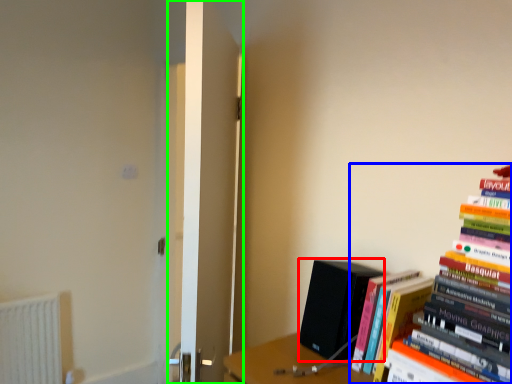
Question: Considering the real-world distances, which object is closest to paperback book (highlighted by a red box)? book (highlighted by a blue box) or door (highlighted by a green box).

Choices:
 (A) book
 (B) door

Answer: (A)